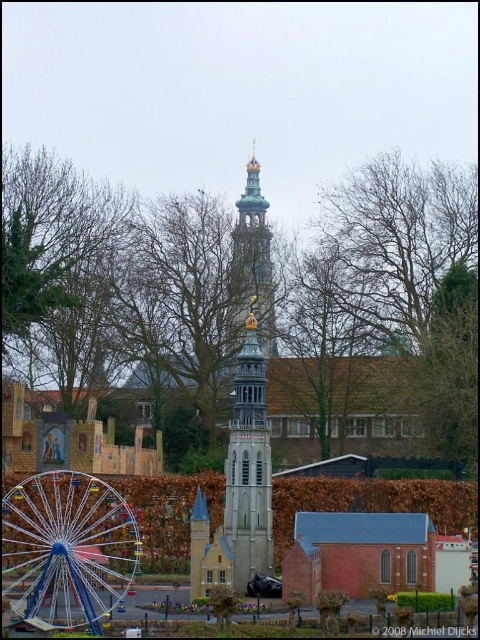
You are a visitor at the theme park and want to take a photo of the bare branches at upper center and the blue metallic ferris wheel at lower left. Which object should you focus on first if you want to capture both in the same frame without moving your camera?

The bare branches at upper center should be focused on first since they are smaller in size compared to the blue metallic ferris wheel at lower left, allowing both to fit within the frame.